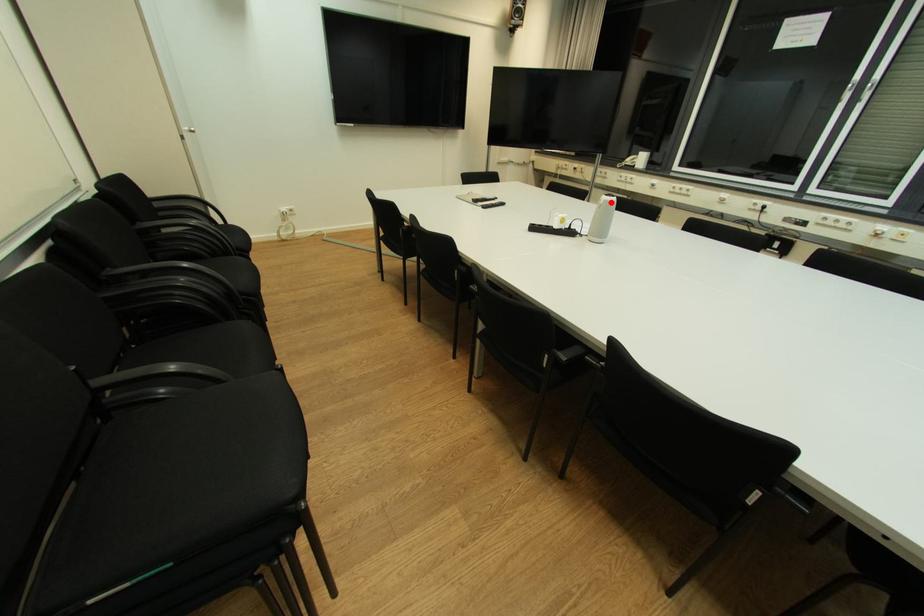
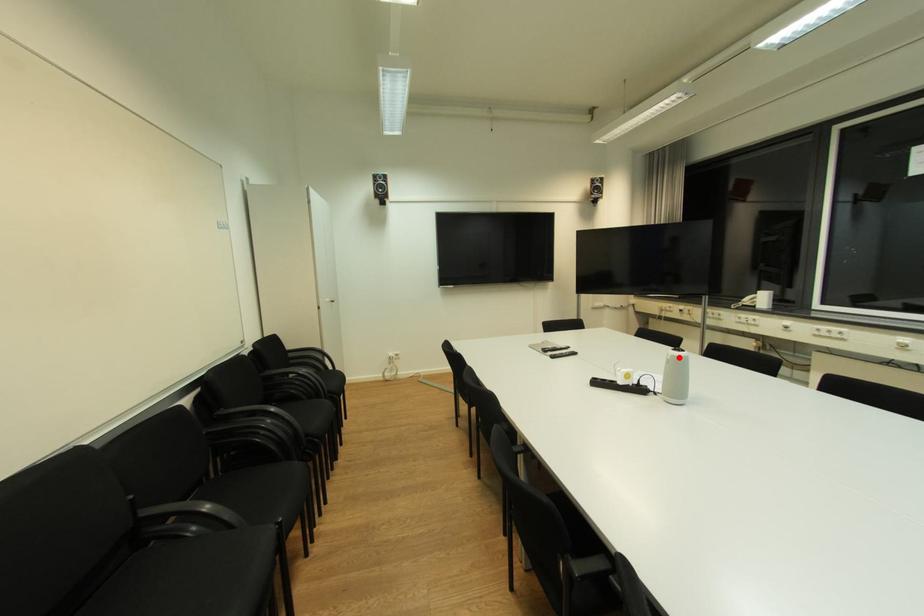
I am providing you with two images of the same scene from different viewpoints. A red point is marked on the first image and another point is marked on the second image. Do the highlighted points in image1 and image2 indicate the same real-world spot?

Yes